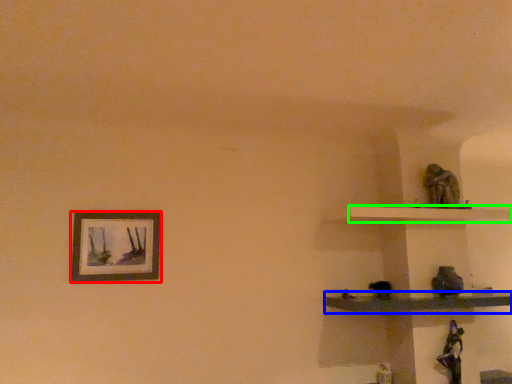
Question: Based on their relative distances, which object is nearer to picture frame (highlighted by a red box)? Choose from shelf (highlighted by a blue box) and shelf (highlighted by a green box).

Choices:
 (A) shelf
 (B) shelf

Answer: (A)